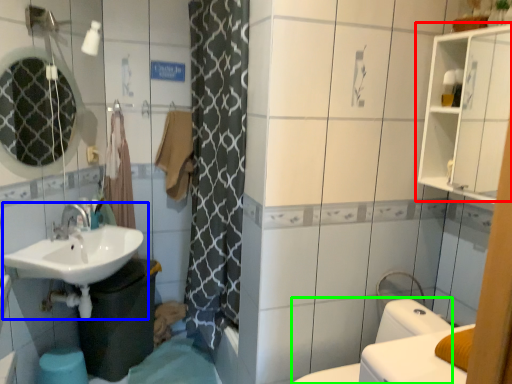
Question: Which object is positioned closest to medicine cabinet (highlighted by a red box)? Select from sink (highlighted by a blue box) and bidet (highlighted by a green box).

Choices:
 (A) sink
 (B) bidet

Answer: (B)